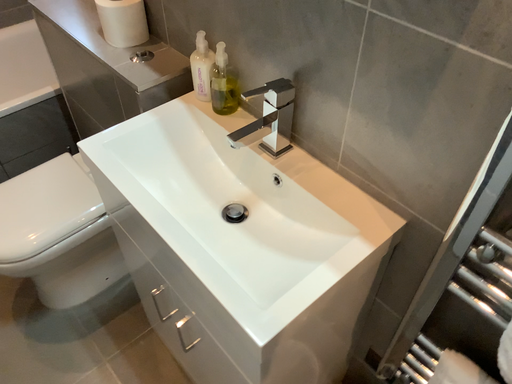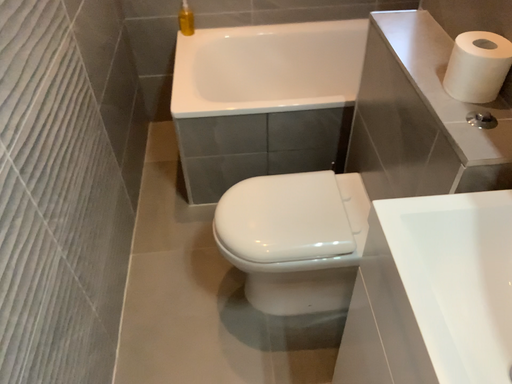
Question: How did the camera likely rotate when shooting the video?

Choices:
 (A) rotated downward
 (B) rotated upward

Answer: (B)